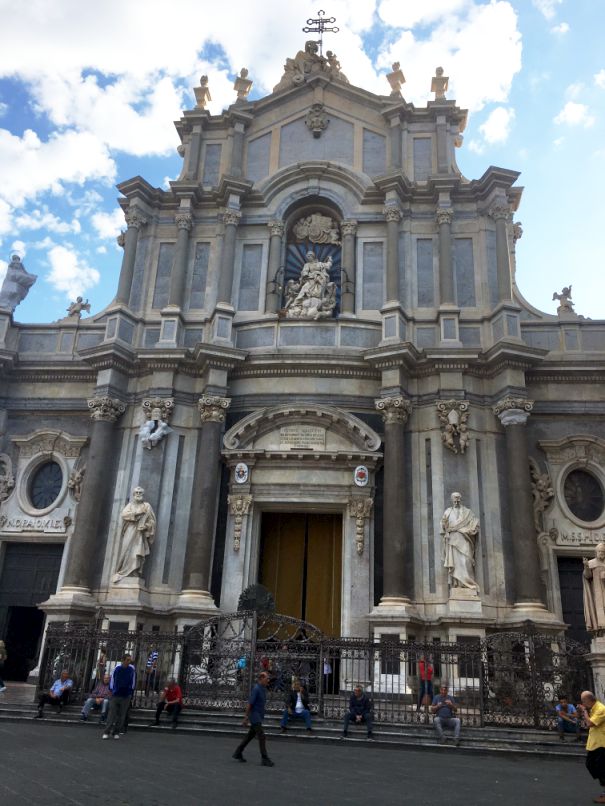
The width and height of the screenshot is (605, 806). What are the coordinates of `statue on left` in the screenshot? It's located at (137, 526).